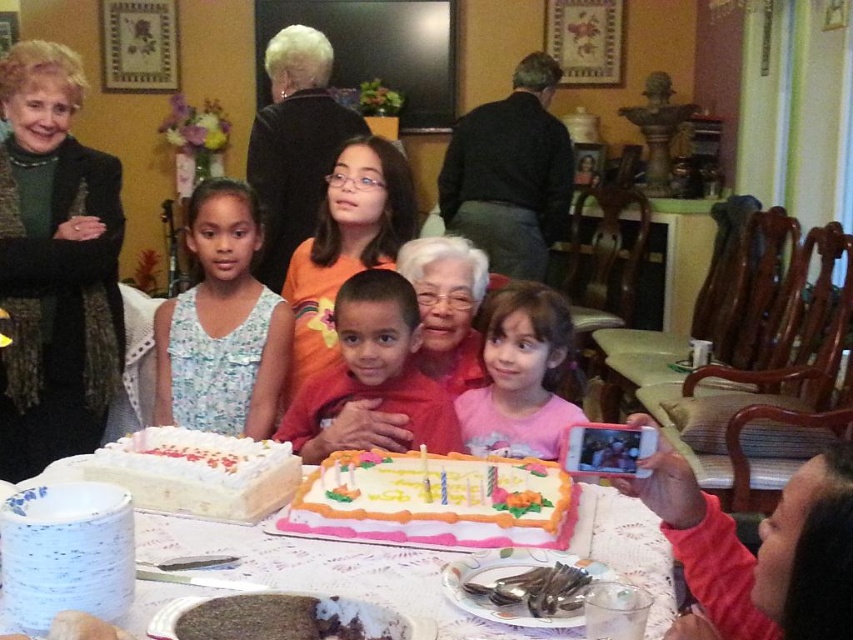
Question: Is white floral dress at center smaller than white frosted cake at lower left?

Choices:
 (A) no
 (B) yes

Answer: (A)

Question: Which point is closer to the camera?

Choices:
 (A) (473, 484)
 (B) (323, 451)
 (C) (463, 436)
 (D) (212, 474)

Answer: (D)

Question: Is pink fabric phone at lower right to the right of pink cotton shirt at center from the viewer's perspective?

Choices:
 (A) no
 (B) yes

Answer: (B)

Question: Which point appears closest to the camera in this image?

Choices:
 (A) (341, 106)
 (B) (210, 216)

Answer: (B)

Question: Does dark green knit sweater at upper left have a lesser width compared to decorative paper cake at center?

Choices:
 (A) yes
 (B) no

Answer: (A)

Question: Which object is positioned farthest from the pink fabric phone at lower right?

Choices:
 (A) decorative paper cake at center
 (B) black fabric at upper center
 (C) matte red shirt at center

Answer: (B)